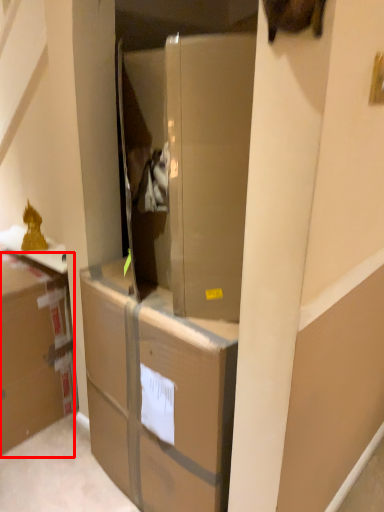
Question: From the image's perspective, considering the relative positions of cardboard box (annotated by the red box) and cabinetry in the image provided, where is cardboard box (annotated by the red box) located with respect to the staircase?

Choices:
 (A) above
 (B) below

Answer: (A)